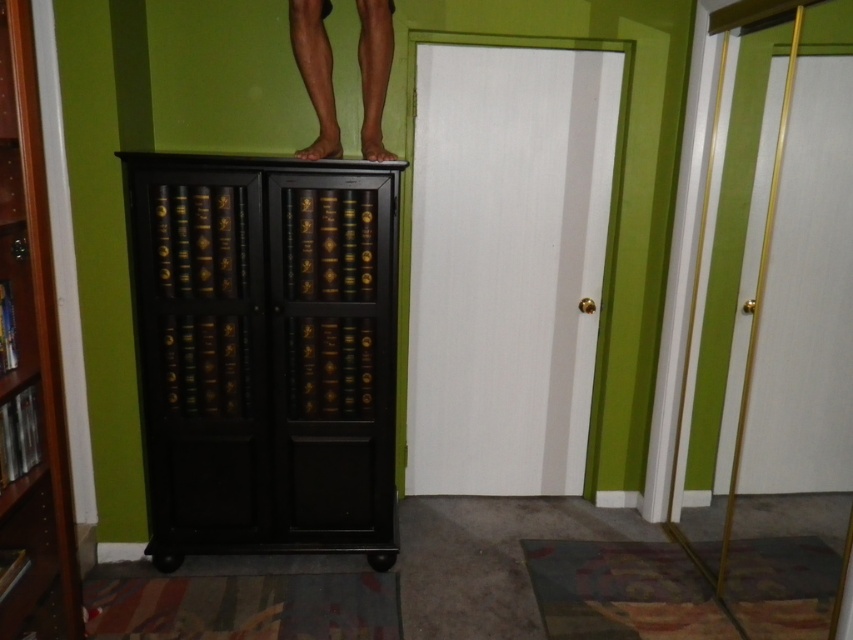
Question: Can you confirm if black wood cabinet at upper center is thinner than black wood bookcase at left?

Choices:
 (A) no
 (B) yes

Answer: (A)

Question: Can you confirm if black wood cabinet at upper center is positioned to the left of black wood bookcase at left?

Choices:
 (A) yes
 (B) no

Answer: (B)

Question: Which point is farther from the camera taking this photo?

Choices:
 (A) (28, 115)
 (B) (231, 374)

Answer: (B)

Question: Does black wood cabinet at upper center lie behind black wood bookcase at left?

Choices:
 (A) no
 (B) yes

Answer: (B)